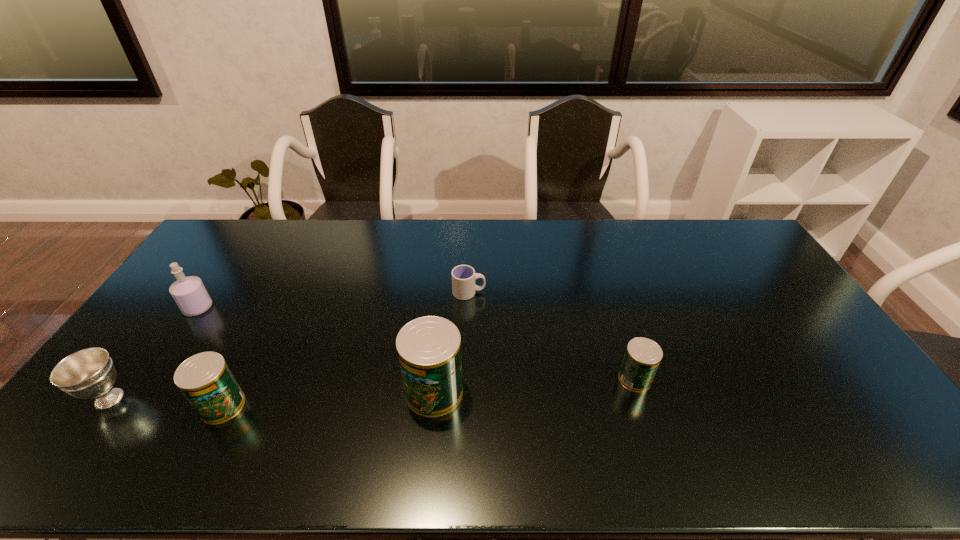
Identify the location of empty space between the chalice and the fifth shortest object. This screenshot has width=960, height=540. (154, 353).

This screenshot has width=960, height=540. What are the coordinates of `vacant area between the cup and the leftmost can` in the screenshot? It's located at (x=346, y=349).

The width and height of the screenshot is (960, 540). I want to click on free space between the chalice and the shortest can, so click(372, 389).

I want to click on object that is the third closest to the second tallest object, so click(429, 348).

This screenshot has width=960, height=540. Identify the location of object that is the closest one to the cup. (429, 348).

You are a GUI agent. You are given a task and a screenshot of the screen. Output one action in this format:
    pyautogui.click(x=<x>, y=<y>)
    Task: Click on the can that is the second nearest to the chalice
    Image resolution: width=960 pixels, height=540 pixels.
    Given the screenshot: What is the action you would take?
    pyautogui.click(x=429, y=348)

Locate an element on the screen. the third closest can to the chalice is located at coordinates (642, 357).

This screenshot has height=540, width=960. I want to click on free location that satisfies the following two spatial constraints: 1. with the handle on the side of the shortest object; 2. on the back side of the rightmost object, so coord(467,379).

Locate an element on the screen. free point that satisfies the following two spatial constraints: 1. on the front side of the shortest can; 2. on the left side of the fifth shortest object is located at coordinates (150, 379).

Where is `free point that satisfies the following two spatial constraints: 1. with the handle on the side of the shortest object; 2. on the right side of the rightmost object`? This screenshot has height=540, width=960. free point that satisfies the following two spatial constraints: 1. with the handle on the side of the shortest object; 2. on the right side of the rightmost object is located at coordinates (467, 379).